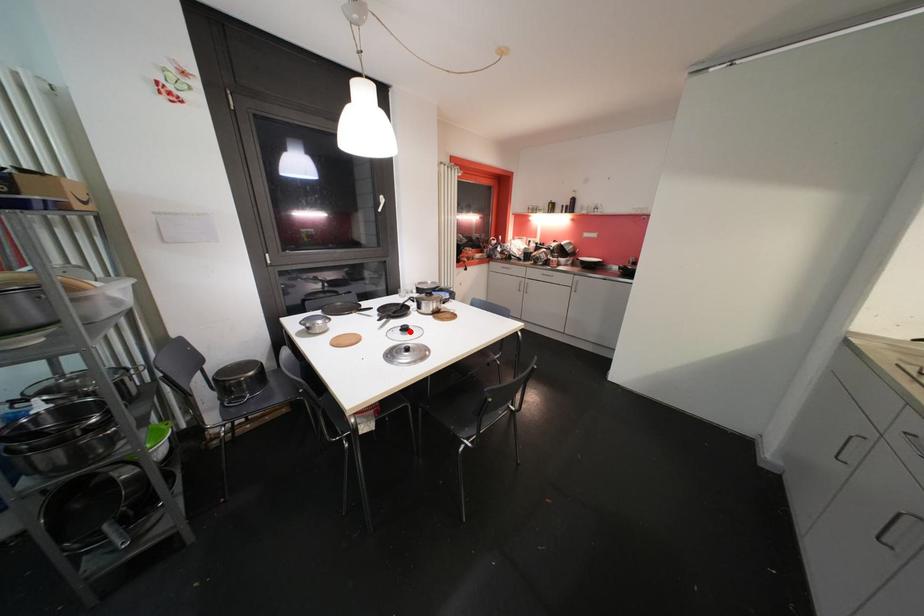
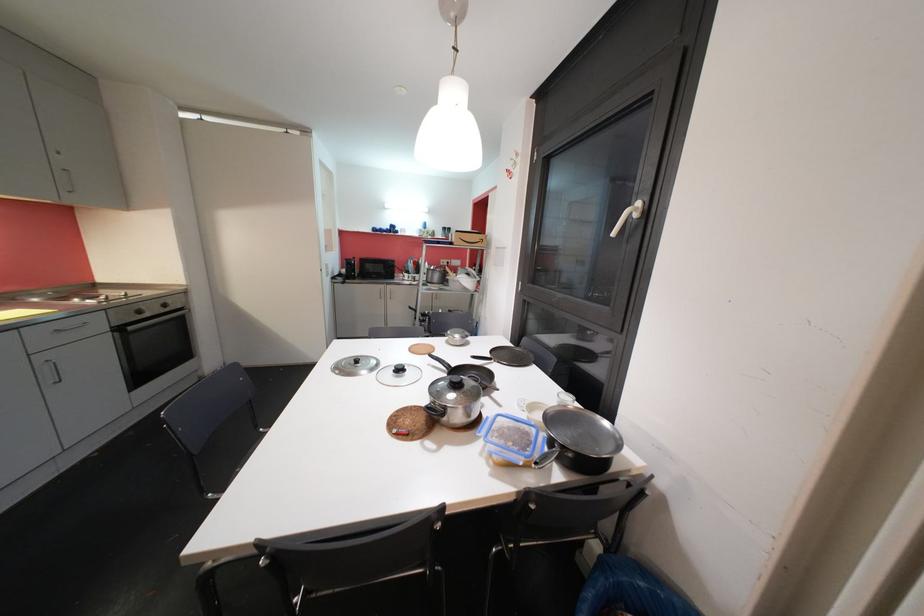
Where in the second image is the point corresponding to the highlighted location from the first image?

(405, 371)